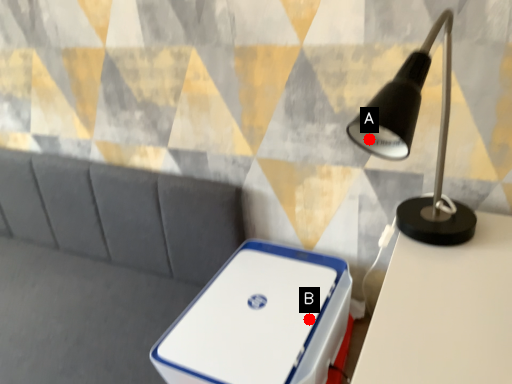
Question: Two points are circled on the image, labeled by A and B beside each circle. Which of the following is the closest to the observer?

Choices:
 (A) A is closer
 (B) B is closer

Answer: (A)